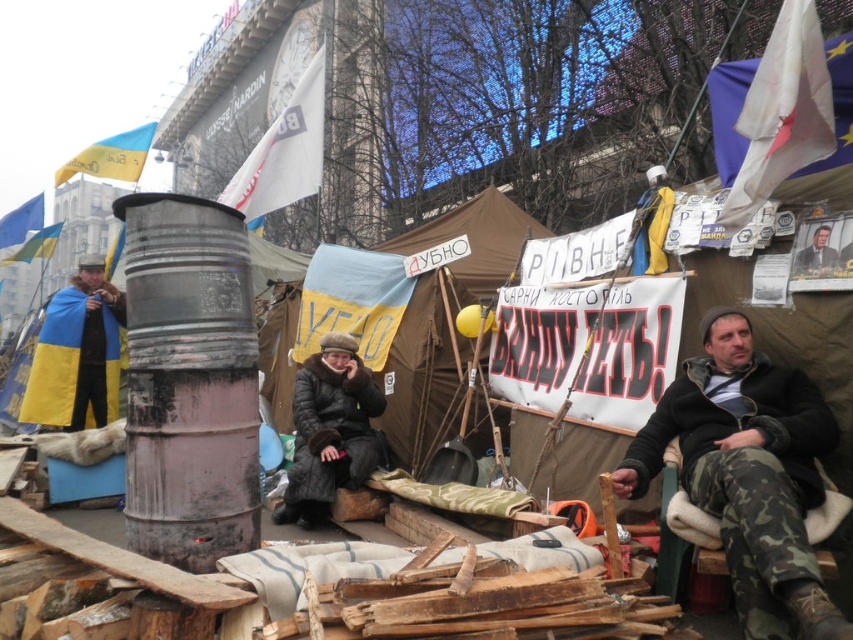
You are organizing a small event and need to decide where to place a new speaker. The speaker requires a space wider than the smooth gray suit at upper right. Is the blue fabric tent at center a suitable location for placing the speaker?

The blue fabric tent at center might be wider than the smooth gray suit at upper right, so it could be a suitable location for placing the speaker if the width requirement is met.

You are a photographer trying to capture the blue fabric tent at center in the image. Given that the tent is located at point coordinates of (x=444, y=321), which is the central focus of the image, can you confirm if the tent is positioned exactly at the center of the image?

Yes, the blue fabric tent at center is positioned exactly at the center of the image as it is marked by the coordinates point (x=444, y=321).